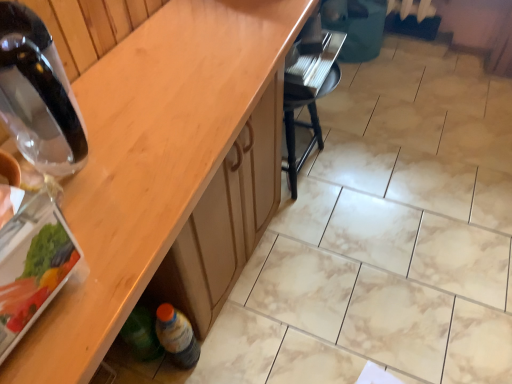
I want to click on free area below transparent glass bottle at left, positioned as the 1th bottle in top-to-bottom order (from a real-world perspective), so click(93, 165).